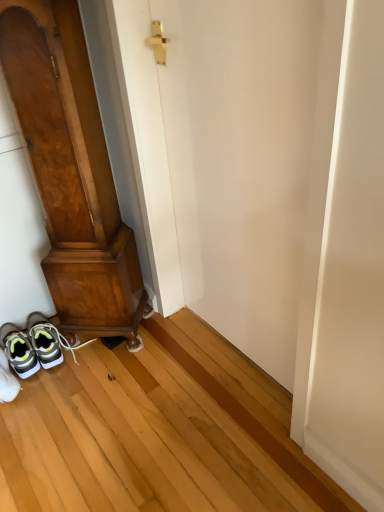
Locate an element on the screen. The height and width of the screenshot is (512, 384). vacant region to the left of white smooth door at center, which ranks as the 1th door in right-to-left order is located at coordinates (137, 387).